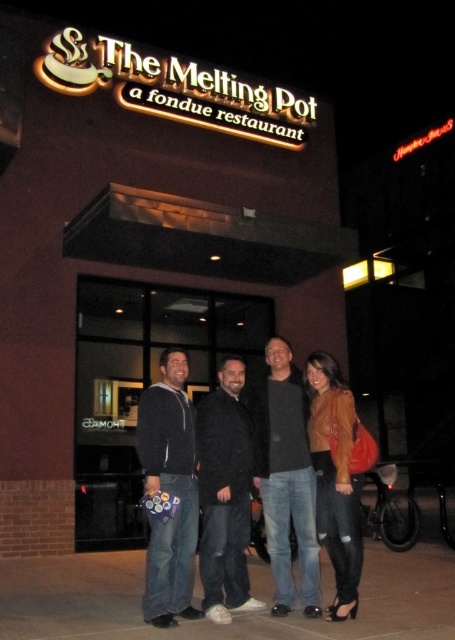
You are a photographer trying to capture a group photo of the dark gray sweater at center and the black wool coat at center. The camera has a minimum focus distance of 12 inches. Will you need to adjust your position to ensure both are in focus?

The dark gray sweater at center and the black wool coat at center are 11.38 inches apart from each other. Since the camera requires a minimum focus distance of 12 inches, you will need to move slightly further away to ensure both are in focus.

You are a photographer trying to capture a group photo of the two men wearing the dark blue fleece jacket at center and the black wool coat at center. To ensure both are in frame, which side should you position yourself relative to the group?

You should position yourself to the right side of the group because the dark blue fleece jacket at center is on the left side of the black wool coat at center, so placing yourself to the right will keep both in the frame.